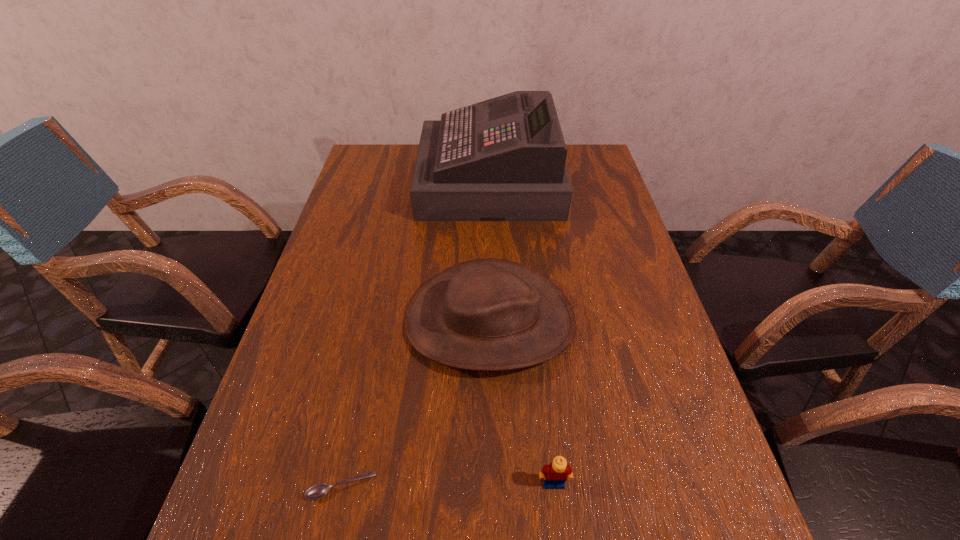
I want to click on unoccupied position between the second tallest object and the Lego, so click(x=522, y=401).

Identify the location of vacant region between the third nearest object and the second shortest object. (522, 401).

Where is `free spot between the second shortest object and the shortest object`? free spot between the second shortest object and the shortest object is located at coordinates (448, 484).

The height and width of the screenshot is (540, 960). Identify the location of empty space between the farthest object and the cowboy hat. (490, 251).

Choose which object is the third nearest neighbor to the second tallest object. Please provide its 2D coordinates. Your answer should be formatted as a tuple, i.e. [(x, y)], where the tuple contains the x and y coordinates of a point satisfying the conditions above.

[(503, 159)]

Locate an element on the screen. This screenshot has height=540, width=960. object that is the third closest to the third tallest object is located at coordinates (503, 159).